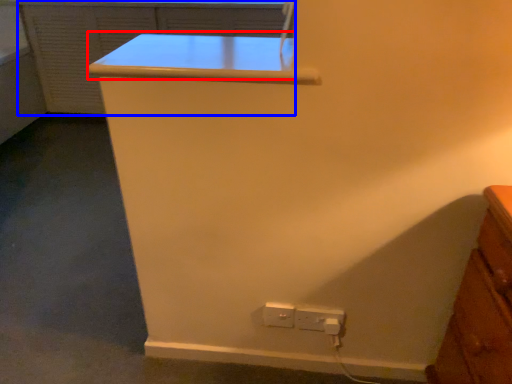
Question: Which point is closer to the camera, table (highlighted by a red box) or file cabinet (highlighted by a blue box)?

Choices:
 (A) table
 (B) file cabinet

Answer: (A)